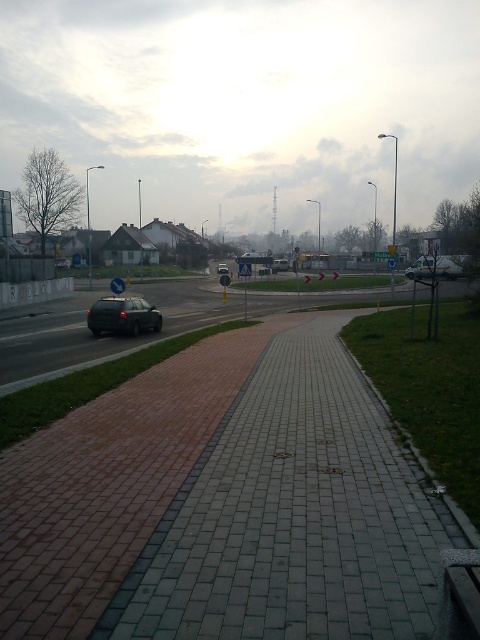
Question: Can you confirm if brick paved sidewalk at center is smaller than satin black car at center?

Choices:
 (A) yes
 (B) no

Answer: (B)

Question: Can you confirm if metallic silver car at center is positioned above matte black car at center?

Choices:
 (A) no
 (B) yes

Answer: (A)

Question: Considering the real-world distances, which object is closest to the black matte car at center?

Choices:
 (A) matte black car at center
 (B) satin black car at center
 (C) metallic silver car at center

Answer: (A)

Question: Which point is farther to the camera?

Choices:
 (A) metallic silver car at center
 (B) satin black car at center
 (C) matte black car at center
 (D) black matte car at center

Answer: (D)

Question: Can you confirm if satin black car at center is wider than matte black car at center?

Choices:
 (A) yes
 (B) no

Answer: (B)

Question: Which point is farther from the camera taking this photo?

Choices:
 (A) (108, 616)
 (B) (222, 273)
 (C) (133, 317)
 (D) (275, 266)

Answer: (D)